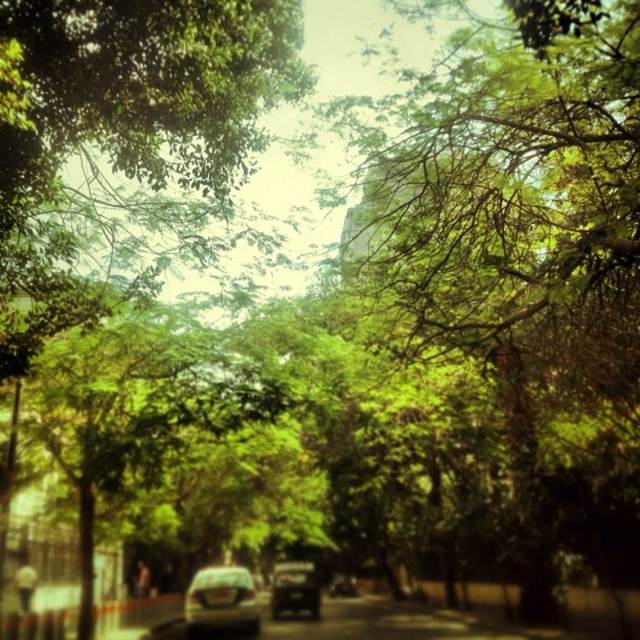
Is matte silver car at center taller than shiny silver car at center?

Correct, matte silver car at center is much taller as shiny silver car at center.

Between point (230, 570) and point (336, 573), which one is positioned in front?

Point (230, 570) is in front.

Is point (230, 624) positioned in front of point (349, 580)?

Yes, it is.

This screenshot has width=640, height=640. What are the coordinates of `matte silver car at center` in the screenshot? It's located at (221, 600).

Who is shorter, matte silver car at center or shiny black car at center?

Standing shorter between the two is shiny black car at center.

Is the position of matte silver car at center more distant than that of shiny black car at center?

No, matte silver car at center is in front of shiny black car at center.

The image size is (640, 640). In order to click on matte silver car at center in this screenshot , I will do `click(221, 600)`.

Is point (310, 570) farther from viewer compared to point (353, 593)?

No, it is not.

Does point (280, 580) come in front of point (330, 595)?

Yes, it is in front of point (330, 595).

Locate an element on the screen. This screenshot has width=640, height=640. shiny black car at center is located at coordinates (294, 588).

Identify the location of shiny black car at center. Image resolution: width=640 pixels, height=640 pixels. (294, 588).